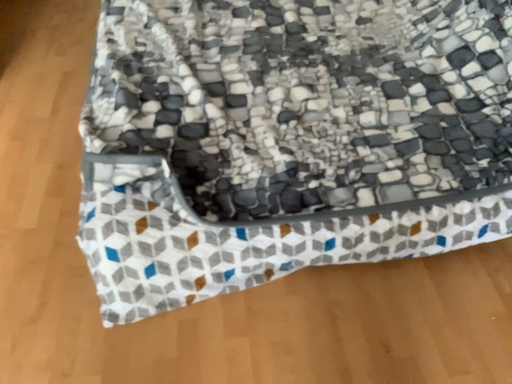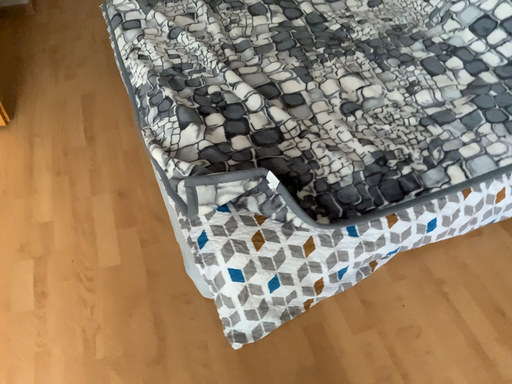
Question: How did the camera likely rotate when shooting the video?

Choices:
 (A) rotated right
 (B) rotated left

Answer: (A)